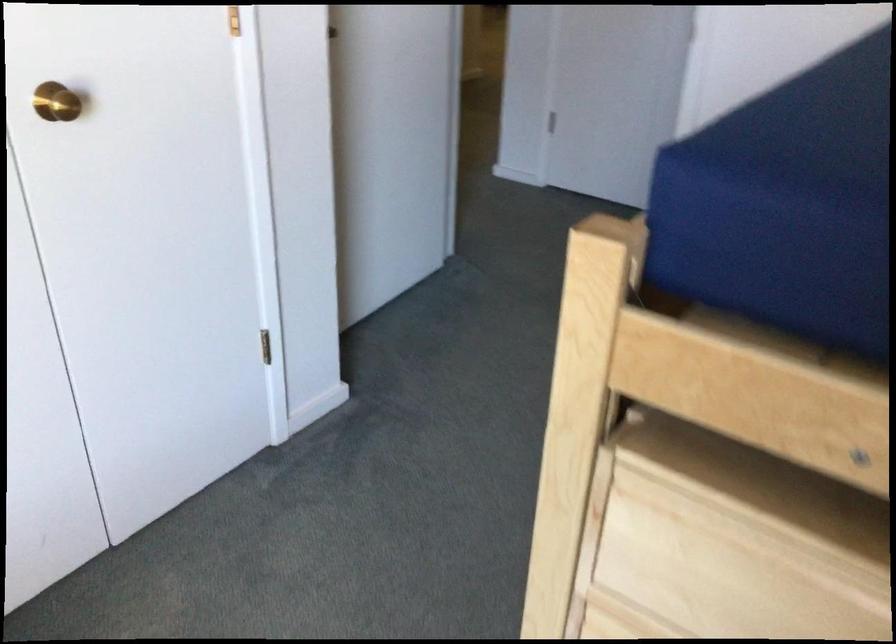
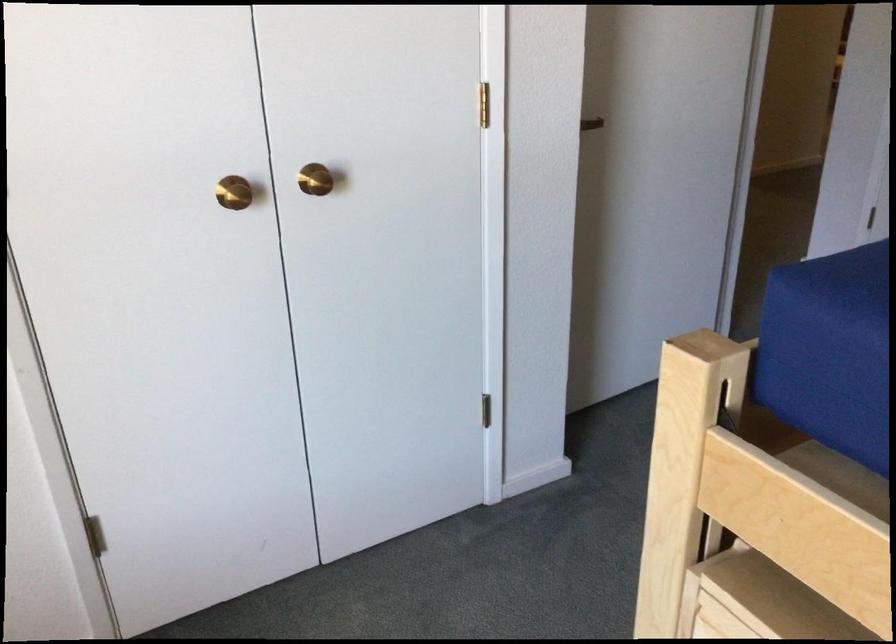
Question: The camera is either moving clockwise (left) or counter-clockwise (right) around the object. The first image is from the beginning of the video and the second image is from the end. Is the camera moving left or right when shooting the video?

Choices:
 (A) Left
 (B) Right

Answer: (B)